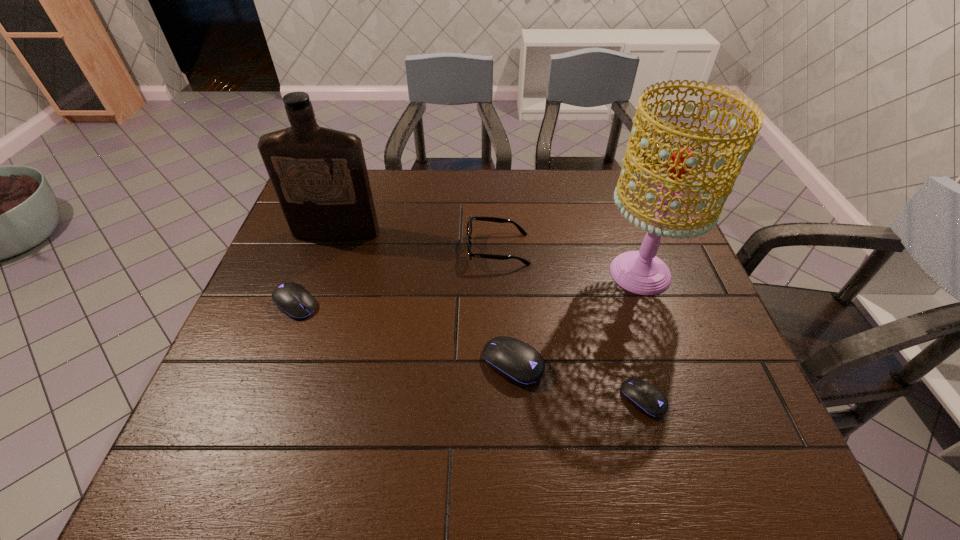
Image resolution: width=960 pixels, height=540 pixels. I want to click on free space between the second shortest object and the tallest computer mouse, so click(404, 334).

In order to click on vacant area that lies between the farthest computer mouse and the lampshade in this screenshot , I will do `click(468, 288)`.

Find the location of a particular element. free area in between the spectacles and the farthest computer mouse is located at coordinates point(396,276).

You are a GUI agent. You are given a task and a screenshot of the screen. Output one action in this format:
    pyautogui.click(x=<x>, y=<y>)
    Task: Click on the vacant space that's between the second computer mouse from left to right and the shortest computer mouse
    This screenshot has width=960, height=540.
    Given the screenshot: What is the action you would take?
    pyautogui.click(x=578, y=381)

Identify which object is the third closest to the rightmost computer mouse. Please provide its 2D coordinates. Your answer should be formatted as a tuple, i.e. [(x, y)], where the tuple contains the x and y coordinates of a point satisfying the conditions above.

[(491, 219)]

Find the location of a particular element. object that is the fourth nearest to the liquor is located at coordinates (641, 272).

In order to click on the closest computer mouse to the rightmost computer mouse in this screenshot , I will do `click(518, 362)`.

Identify which computer mouse is the closest to the second shortest computer mouse. Please provide its 2D coordinates. Your answer should be formatted as a tuple, i.e. [(x, y)], where the tuple contains the x and y coordinates of a point satisfying the conditions above.

[(518, 362)]

The height and width of the screenshot is (540, 960). I want to click on free space in the image that satisfies the following two spatial constraints: 1. on the label side of the lampshade; 2. on the right side of the liquor, so click(x=323, y=273).

Image resolution: width=960 pixels, height=540 pixels. I want to click on vacant space that satisfies the following two spatial constraints: 1. on the lenses of the tallest computer mouse; 2. on the left side of the third tallest object, so click(x=503, y=363).